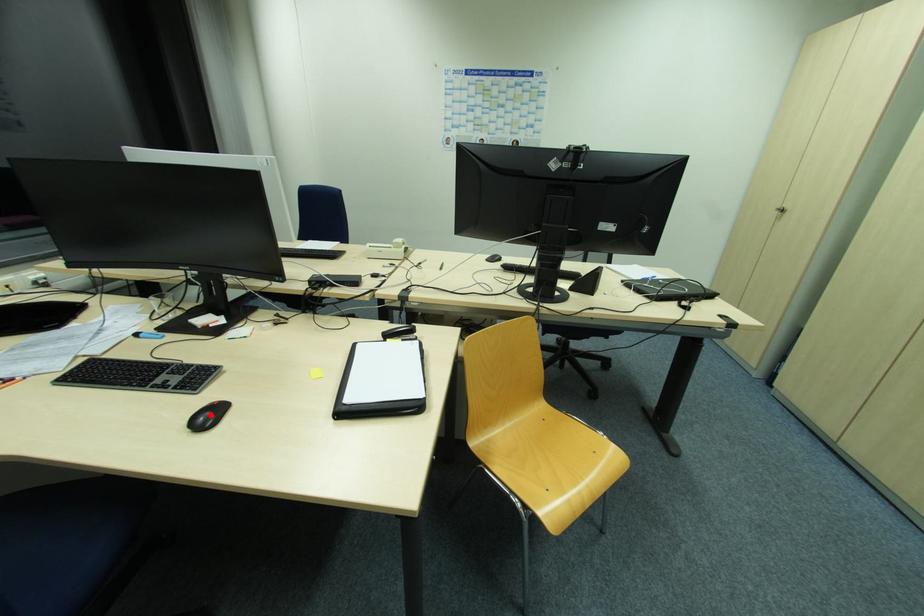
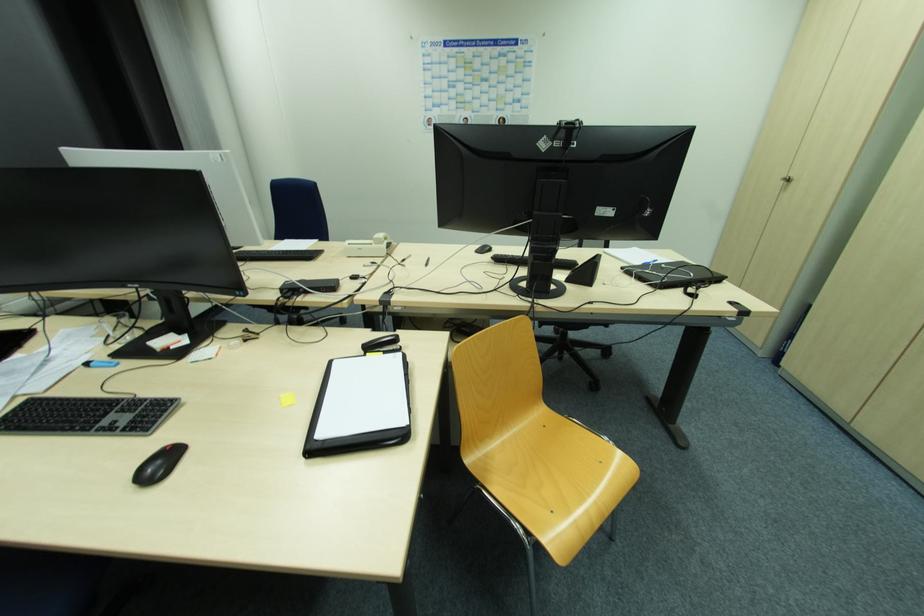
The point at the highlighted location is marked in the first image. Where is the corresponding point in the second image?

(161, 463)